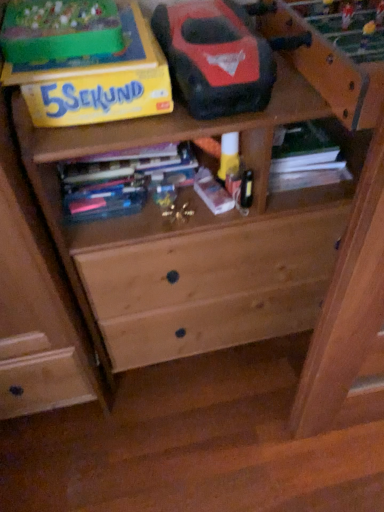
Question: Considering the positions of yellow cardboard box at upper left and multicolored paperbacks at center, placed as the third book when sorted from right to left, in the image, is yellow cardboard box at upper left taller or shorter than multicolored paperbacks at center, placed as the third book when sorted from right to left,?

Choices:
 (A) short
 (B) tall

Answer: (B)

Question: From a real-world perspective, is yellow cardboard box at upper left above or below multicolored paperbacks at center, which is the 1th book in left-to-right order?

Choices:
 (A) above
 (B) below

Answer: (A)

Question: Which of these objects is positioned farthest from the matte plastic book at center, placed as the second book when sorted from left to right?

Choices:
 (A) yellow cardboard box at upper left
 (B) multicolored paperbacks at center, placed as the third book when sorted from right to left
 (C) green matte book at upper right, which is the third book in left-to-right order

Answer: (A)

Question: Estimate the real-world distances between objects in this image. Which object is farther from the matte plastic book at center, the second book from the right?

Choices:
 (A) yellow cardboard box at upper left
 (B) multicolored paperbacks at center, which is the 1th book in left-to-right order
 (C) green matte book at upper right, the 1th book positioned from the right

Answer: (A)